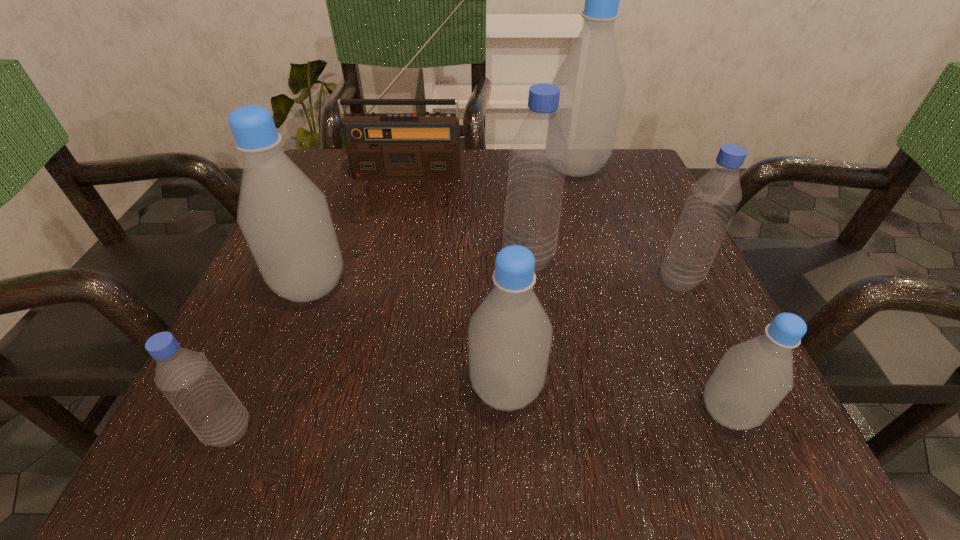
You are a GUI agent. You are given a task and a screenshot of the screen. Output one action in this format:
    pyautogui.click(x=<x>, y=<y>)
    Task: Click on the radio receiver that is at the far edge
    The width and height of the screenshot is (960, 540).
    Given the screenshot: What is the action you would take?
    pyautogui.click(x=425, y=146)

The image size is (960, 540). In order to click on radio receiver that is at the left edge in this screenshot , I will do `click(425, 146)`.

Find the location of a particular element. This screenshot has height=540, width=960. object that is positioned at the far left corner is located at coordinates (425, 146).

At what (x,y) coordinates should I click in order to perform the action: click on object positioned at the near left corner. Please return your answer as a coordinate pair (x, y). Image resolution: width=960 pixels, height=540 pixels. Looking at the image, I should click on (188, 380).

Image resolution: width=960 pixels, height=540 pixels. I want to click on object located at the far right corner, so pos(592,87).

At what (x,y) coordinates should I click in order to perform the action: click on object at the near right corner. Please return your answer as a coordinate pair (x, y). Looking at the image, I should click on (752, 378).

You are a GUI agent. You are given a task and a screenshot of the screen. Output one action in this format:
    pyautogui.click(x=<x>, y=<y>)
    Task: Click on the vacant space at the far edge of the desktop
    
    Given the screenshot: What is the action you would take?
    pyautogui.click(x=468, y=163)

I want to click on vacant space at the right edge, so click(683, 349).

Identify the location of free spot at the far left corner of the desktop. Image resolution: width=960 pixels, height=540 pixels. pyautogui.click(x=333, y=180).

Where is `free space at the near left corner of the desktop`? free space at the near left corner of the desktop is located at coordinates (265, 416).